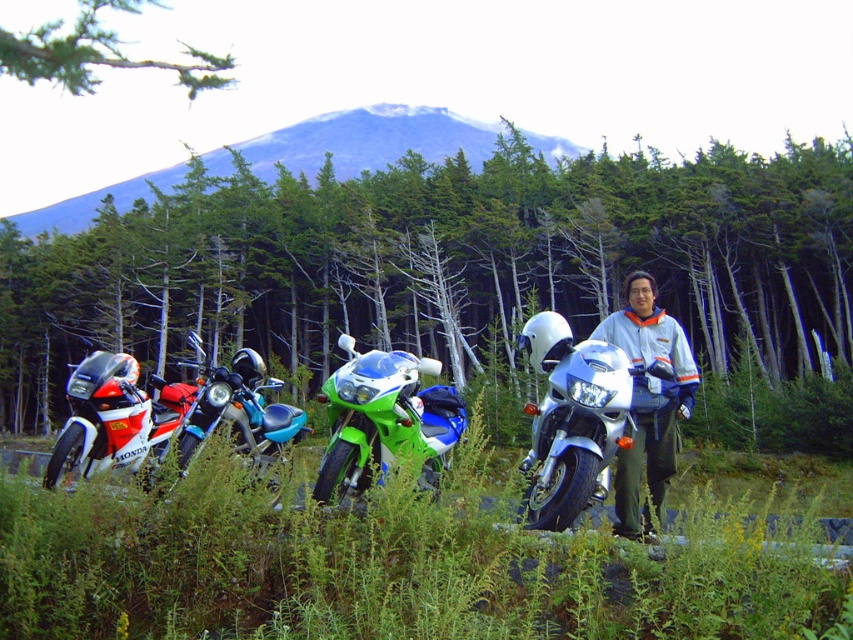
You are standing in the middle of the grassy area where the motorcycles are parked. You want to take a photo of the green matte tree at center without any motorcycles blocking the view. Which direction should you move to ensure the tree is fully visible?

The green matte tree at center is located at point (x=438, y=259) in the image. To avoid blocking by motorcycles, you should move towards the direction where the tree is positioned, ensuring that the motorcycles are not between you and the tree. Since the tree is at the center, moving directly towards it while positioning yourself so that the motorcycles are to the sides or behind you would keep the tree visible.

Looking at this image, you are standing at the center of the grassy area and see the motorcycles lined up in front of you. Which motorcycle is closest to the point marked at coordinates (438,259)?

The green matte tree at center is located at point (438,259), so the motorcycle closest to this point would be the green and white motorcycle.

You are standing at the starting point and need to reach the destination point. The starting point is point (711, 536) and the destination is point (619, 481). According to the scene, which direction should you move to get from the starting point to the destination?

To move from point (711, 536) to point (619, 481), you should move backward since the destination point is behind the starting point according to the spatial arrangement in the scene.